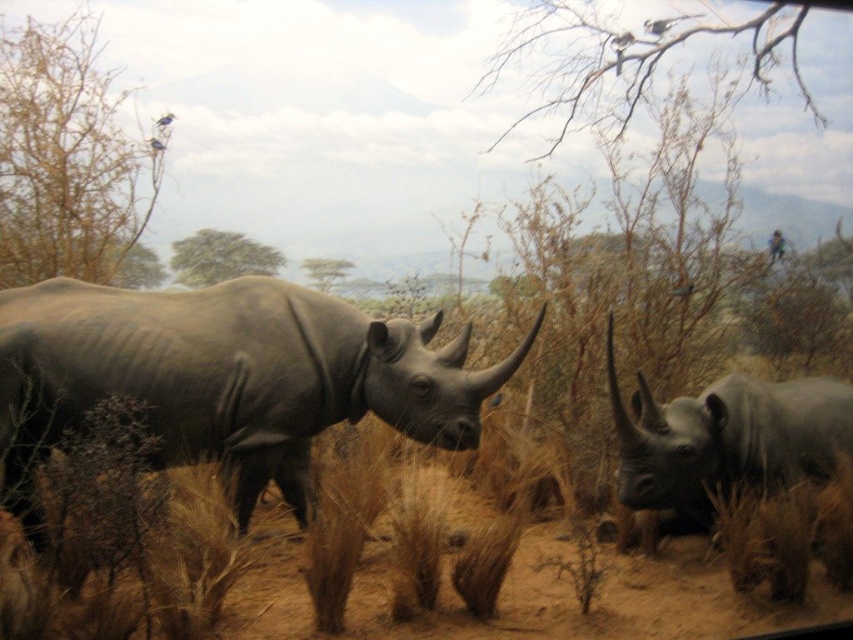
You are standing in front of a museum exhibit of a savanna diorama. You notice a small point marked at coordinates point (7, 458). If you want to reach that point without moving your feet, can you just stretch your arm out to touch it?

The point (7, 458) is 4.70 meters away from camera. Since the average human arm length is about 0.7 meters, you cannot reach it without moving your feet.